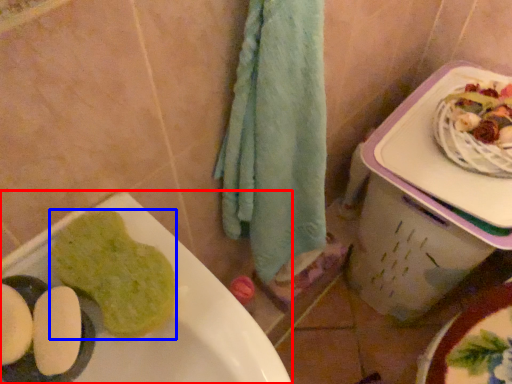
Question: Among these objects, which one is nearest to the camera, sink (highlighted by a red box) or food (highlighted by a blue box)?

Choices:
 (A) sink
 (B) food

Answer: (A)